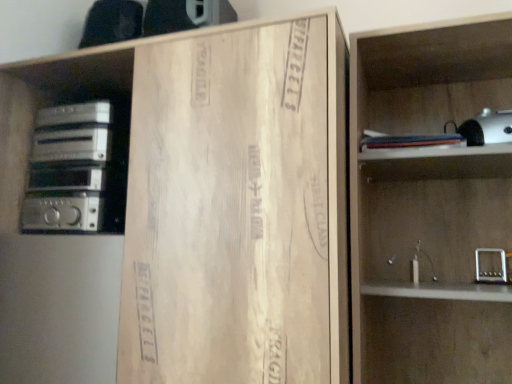
Question: Looking at the image, does wooden cardboard at center seem bigger or smaller compared to silver metallic stereo at left?

Choices:
 (A) big
 (B) small

Answer: (A)

Question: From the image's perspective, is wooden cardboard at center located above or below silver metallic stereo at left?

Choices:
 (A) above
 (B) below

Answer: (B)

Question: Which of these objects is positioned closest to the wooden cardboard at center?

Choices:
 (A) silver metallic stereo at left
 (B) wooden shelf at right

Answer: (B)

Question: Which is farther from the wooden cardboard at center?

Choices:
 (A) wooden shelf at right
 (B) silver metallic stereo at left

Answer: (B)